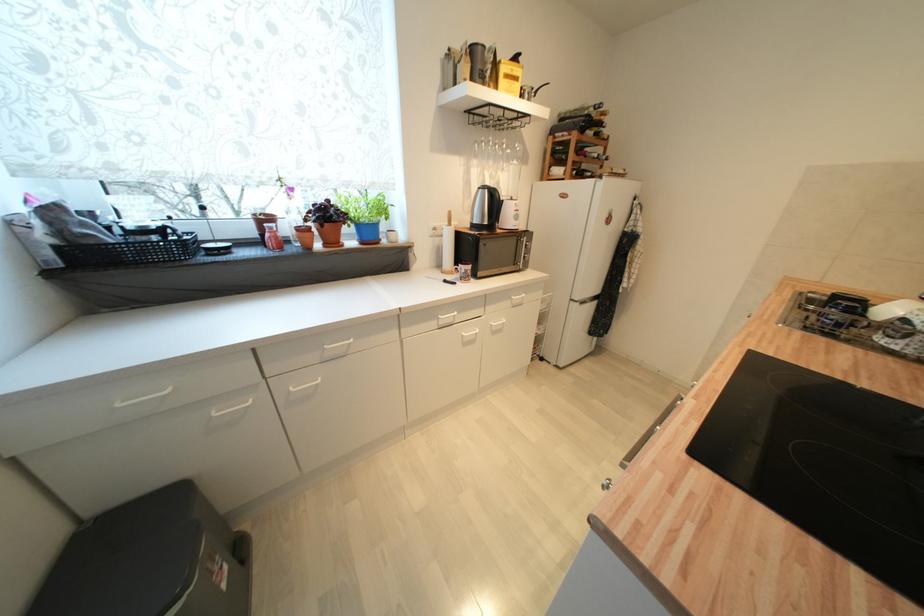
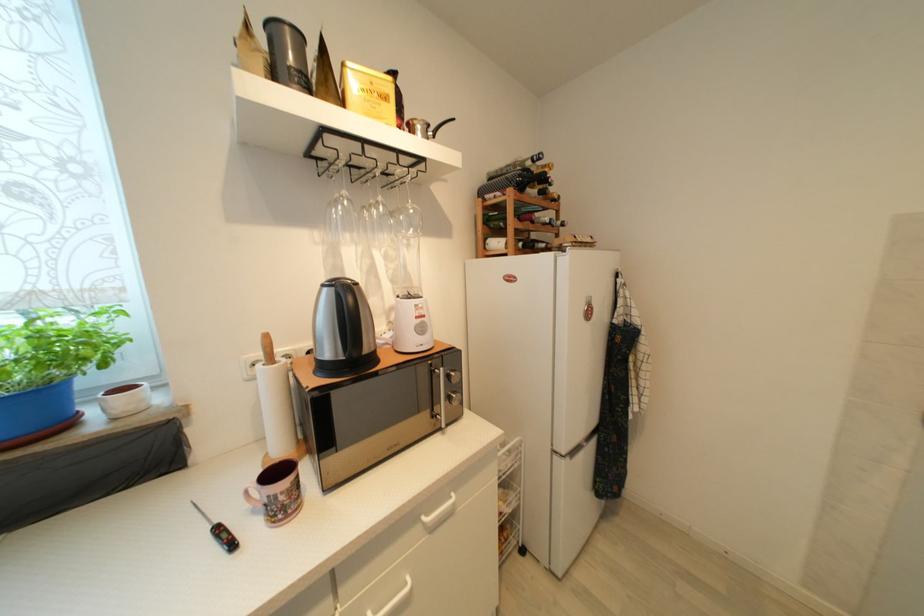
In the second image, find the point that corresponds to (529,257) in the first image.

(455, 400)